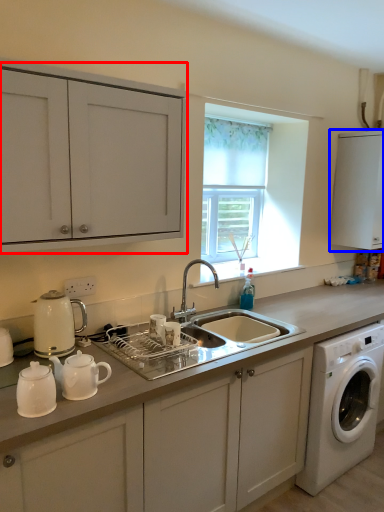
Question: Which object appears closest to the camera in this image, cabinetry (highlighted by a red box) or cabinetry (highlighted by a blue box)?

Choices:
 (A) cabinetry
 (B) cabinetry

Answer: (A)